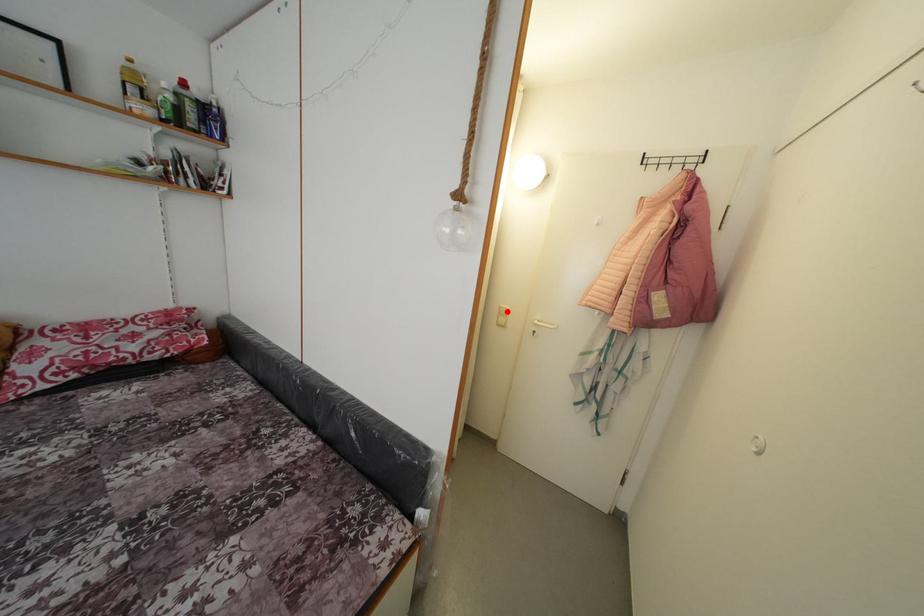
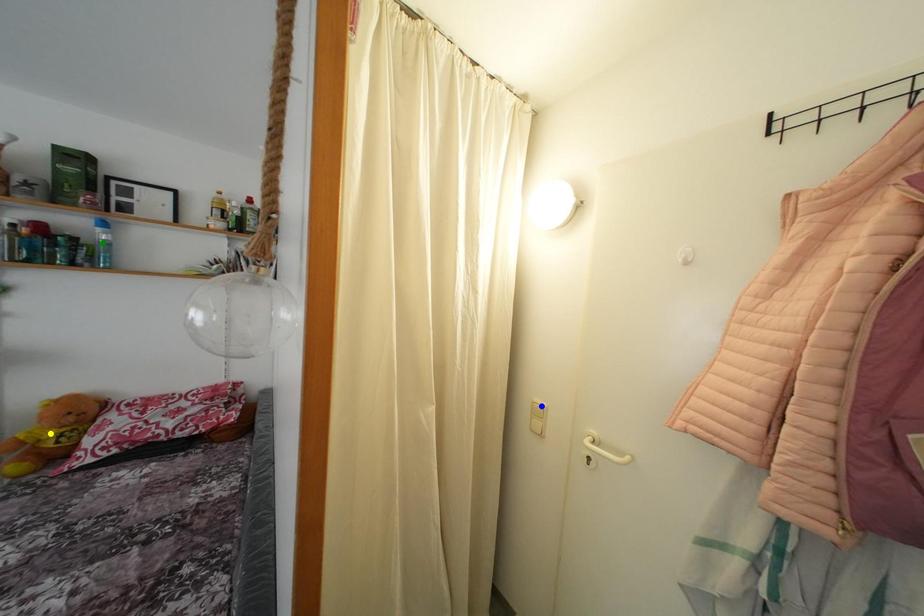
Question: I am providing you with two images of the same scene from different viewpoints. A red point is marked on the first image. You are given multiple points on the second image. Which point in image 2 is actually the same real-world point as the red point in image 1?

Choices:
 (A) yellow point
 (B) blue point
 (C) green point

Answer: (B)